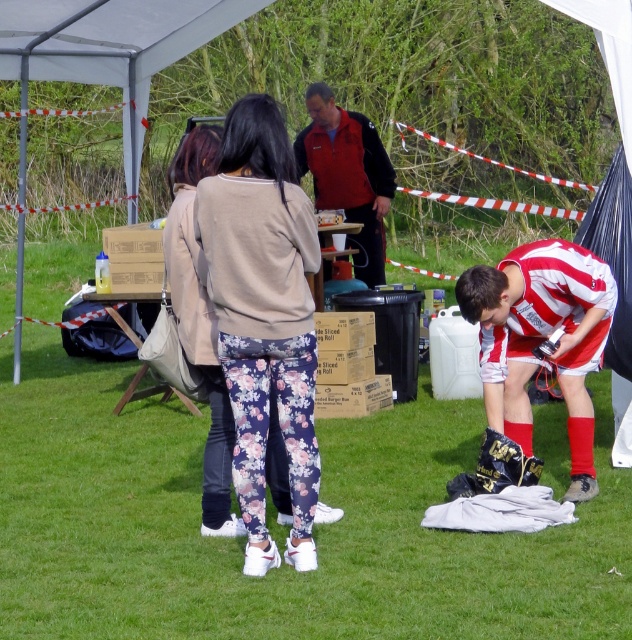
You are organizing a clothing donation drive and need to determine which item takes up more space in the donation box. Based on the image, which object between the striped jersey at lower right and the red jacket at center is wider?

The striped jersey at lower right is wider than the red jacket at center, so it takes up more space in the donation box.

You are planning to set up a small picnic blanket in the area where the green grass at lower center and striped jersey at lower right are located. Which of these two areas would allow you to spread the blanket more comfortably?

The green grass at lower center is bigger than the striped jersey at lower right, so you can spread the picnic blanket more comfortably there.